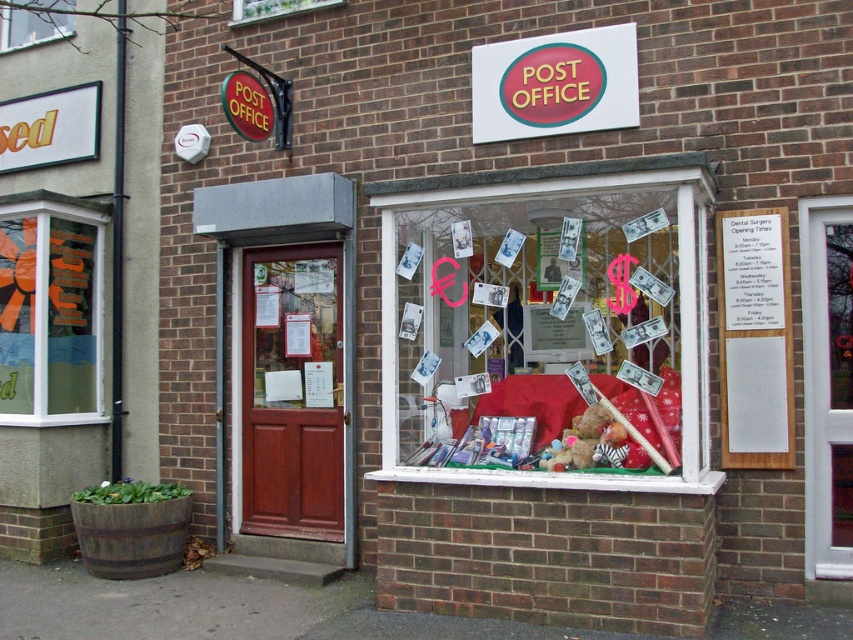
Does white plastic door at center have a greater height compared to matte plastic sign at upper center?

Yes, white plastic door at center is taller than matte plastic sign at upper center.

Between point (825, 406) and point (523, 42), which one is positioned behind?

The point (523, 42) is behind.

You are a GUI agent. You are given a task and a screenshot of the screen. Output one action in this format:
    pyautogui.click(x=<x>, y=<y>)
    Task: Click on the white plastic door at center
    This screenshot has height=640, width=853.
    Given the screenshot: What is the action you would take?
    pyautogui.click(x=827, y=384)

This screenshot has width=853, height=640. Find the location of `matte plastic sign at upper center`. matte plastic sign at upper center is located at coordinates (555, 83).

Looking at this image, who is more distant from viewer, (x=635, y=112) or (x=62, y=13)?

The point (x=62, y=13) is behind.

Where is `matte plastic sign at upper center`? This screenshot has height=640, width=853. matte plastic sign at upper center is located at coordinates (555, 83).

Does transparent glass window at left come in front of transparent glass window at upper center?

Yes, transparent glass window at left is closer to the viewer.

How far apart are transparent glass window at left and transparent glass window at upper center?

transparent glass window at left and transparent glass window at upper center are 7.03 feet apart from each other.

Is point (48, 220) positioned in front of point (27, 44)?

That is True.

At what (x,y) coordinates should I click in order to perform the action: click on transparent glass window at left. Please return your answer as a coordinate pair (x, y). This screenshot has height=640, width=853. Looking at the image, I should click on (49, 314).